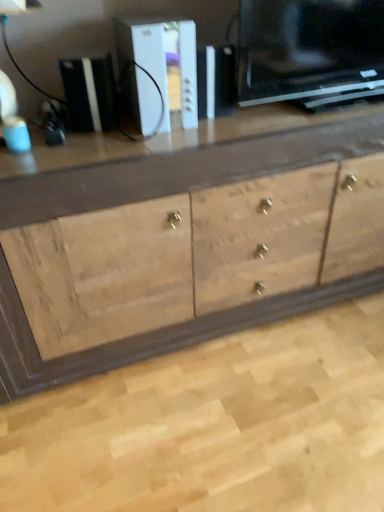
Question: From the image's perspective, is white plastic console at center, arranged as the second appliance when viewed from the left, over white plastic gaming console at upper center, the second appliance when ordered from right to left?

Choices:
 (A) no
 (B) yes

Answer: (B)

Question: Can you confirm if white plastic console at center, arranged as the second appliance when viewed from the left, is shorter than white plastic gaming console at upper center, the second appliance when ordered from right to left?

Choices:
 (A) yes
 (B) no

Answer: (B)

Question: Is white plastic console at center, arranged as the second appliance when viewed from the left, not close to white plastic gaming console at upper center, the 1th appliance when ordered from left to right?

Choices:
 (A) no
 (B) yes

Answer: (A)

Question: Is white plastic console at center, which is counted as the 1th appliance, starting from the right, to the right of white plastic gaming console at upper center, the second appliance when ordered from right to left, from the viewer's perspective?

Choices:
 (A) yes
 (B) no

Answer: (A)

Question: Considering the relative sizes of white plastic console at center, which is counted as the 1th appliance, starting from the right, and white plastic gaming console at upper center, the 1th appliance when ordered from left to right, in the image provided, is white plastic console at center, which is counted as the 1th appliance, starting from the right, wider than white plastic gaming console at upper center, the 1th appliance when ordered from left to right,?

Choices:
 (A) no
 (B) yes

Answer: (B)

Question: Can you confirm if white plastic console at center, which is counted as the 1th appliance, starting from the right, is bigger than white plastic gaming console at upper center, the second appliance when ordered from right to left?

Choices:
 (A) no
 (B) yes

Answer: (B)

Question: Can you confirm if white plastic gaming console at upper center, the 1th appliance when ordered from left to right, is thinner than white plastic console at center, which is counted as the 1th appliance, starting from the right?

Choices:
 (A) no
 (B) yes

Answer: (B)

Question: From the image's perspective, does white plastic gaming console at upper center, the 1th appliance when ordered from left to right, appear lower than white plastic console at center, arranged as the second appliance when viewed from the left?

Choices:
 (A) yes
 (B) no

Answer: (A)

Question: Is white plastic console at center, arranged as the second appliance when viewed from the left, at the back of white plastic gaming console at upper center, the second appliance when ordered from right to left?

Choices:
 (A) yes
 (B) no

Answer: (A)

Question: Can you confirm if white plastic gaming console at upper center, the 1th appliance when ordered from left to right, is shorter than white plastic console at center, arranged as the second appliance when viewed from the left?

Choices:
 (A) no
 (B) yes

Answer: (B)

Question: Can you see white plastic gaming console at upper center, the 1th appliance when ordered from left to right, touching white plastic console at center, which is counted as the 1th appliance, starting from the right?

Choices:
 (A) no
 (B) yes

Answer: (A)

Question: Is white plastic gaming console at upper center, the second appliance when ordered from right to left, to the left of white plastic console at center, which is counted as the 1th appliance, starting from the right, from the viewer's perspective?

Choices:
 (A) no
 (B) yes

Answer: (B)

Question: From the image's perspective, is natural wood cabinet at center above white plastic gaming console at upper center, the second appliance when ordered from right to left?

Choices:
 (A) no
 (B) yes

Answer: (A)